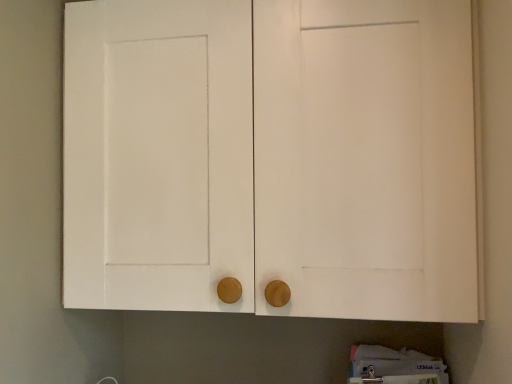
Question: Should I look upward or downward to see white wood cabinet at center?

Choices:
 (A) down
 (B) up

Answer: (B)